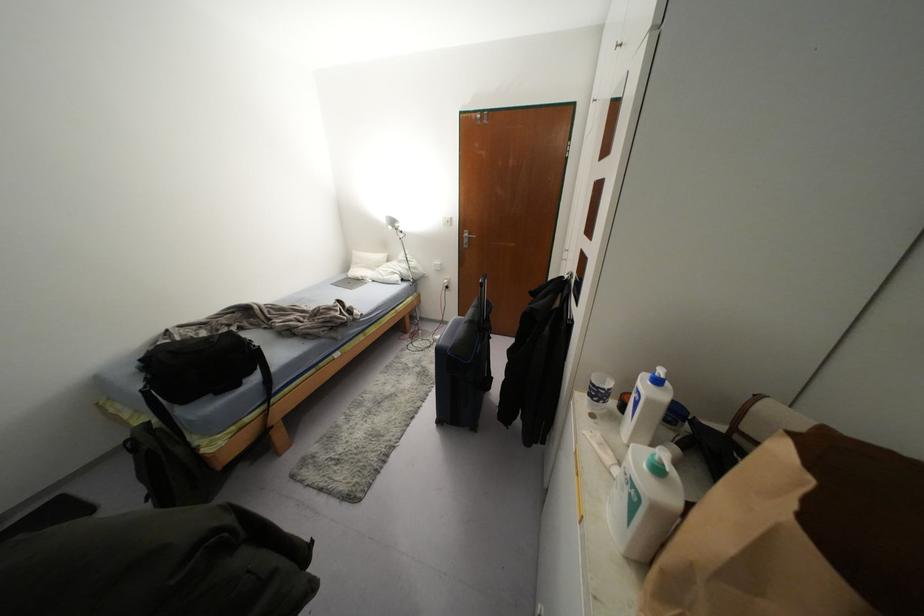
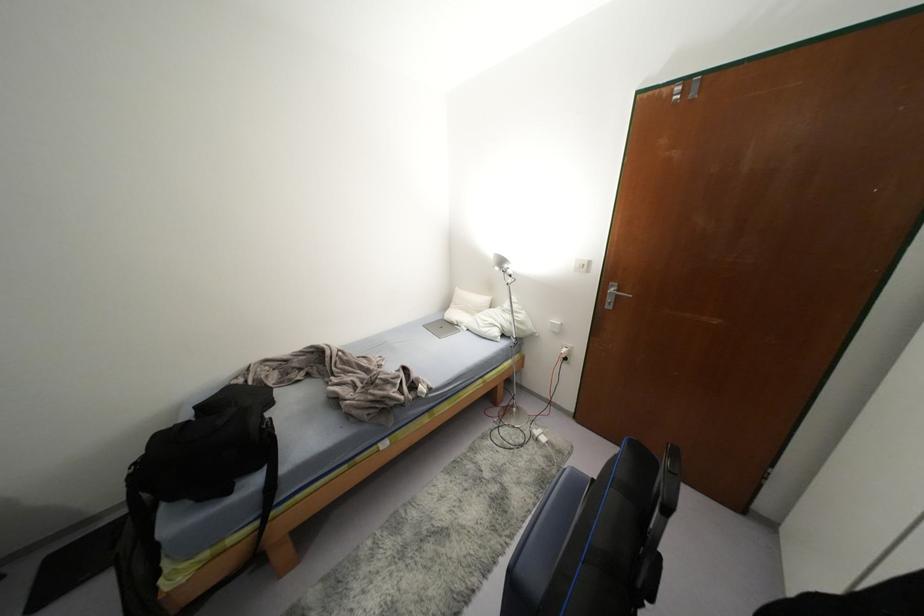
The point at (395, 225) is marked in the first image. Where is the corresponding point in the second image?

(505, 265)